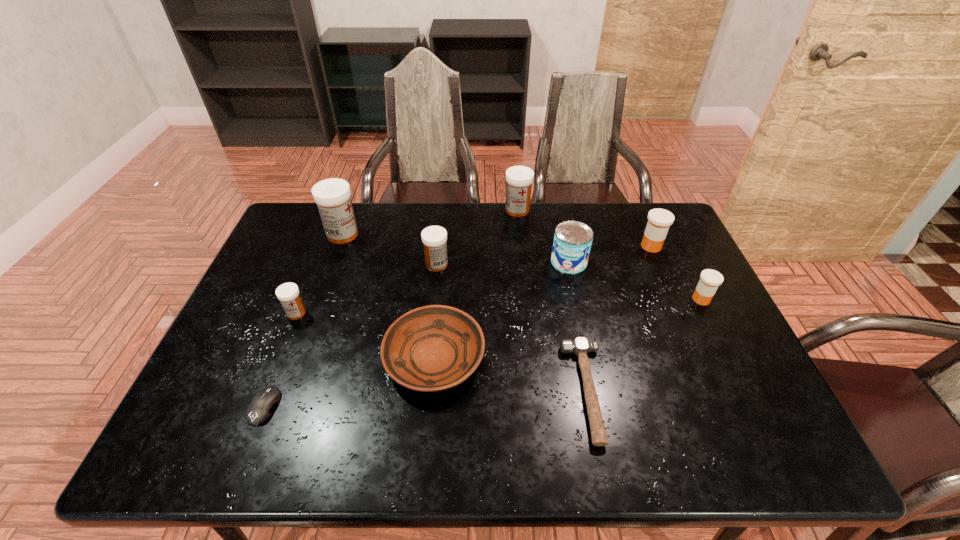
I want to click on free space at the right edge of the desktop, so click(x=699, y=355).

Locate an element on the screen. The height and width of the screenshot is (540, 960). free space at the far left corner of the desktop is located at coordinates (292, 235).

Locate an element on the screen. This screenshot has width=960, height=540. vacant space at the near right corner of the desktop is located at coordinates (731, 460).

I want to click on free space between the smallest white medicine and the second farthest white medicine, so click(x=320, y=274).

Find the location of a particular element. This screenshot has width=960, height=540. empty space that is in between the blue can and the farthest medicine is located at coordinates (543, 236).

The height and width of the screenshot is (540, 960). In order to click on empty space between the third shortest object and the farther orange medicine in this screenshot , I will do `click(542, 302)`.

At what (x,y) coordinates should I click in order to perform the action: click on empty space that is in between the left orange medicine and the right orange medicine. Please return your answer as a coordinate pair (x, y). The image size is (960, 540). Looking at the image, I should click on (676, 273).

Locate an element on the screen. This screenshot has width=960, height=540. free area in between the computer equipment and the second farthest white medicine is located at coordinates (303, 320).

This screenshot has height=540, width=960. Identify the location of unoccupied area between the blue can and the bigger orange medicine. (610, 254).

Where is `vacant area that lies between the fourth medicine from left to right and the can`? vacant area that lies between the fourth medicine from left to right and the can is located at coordinates (543, 236).